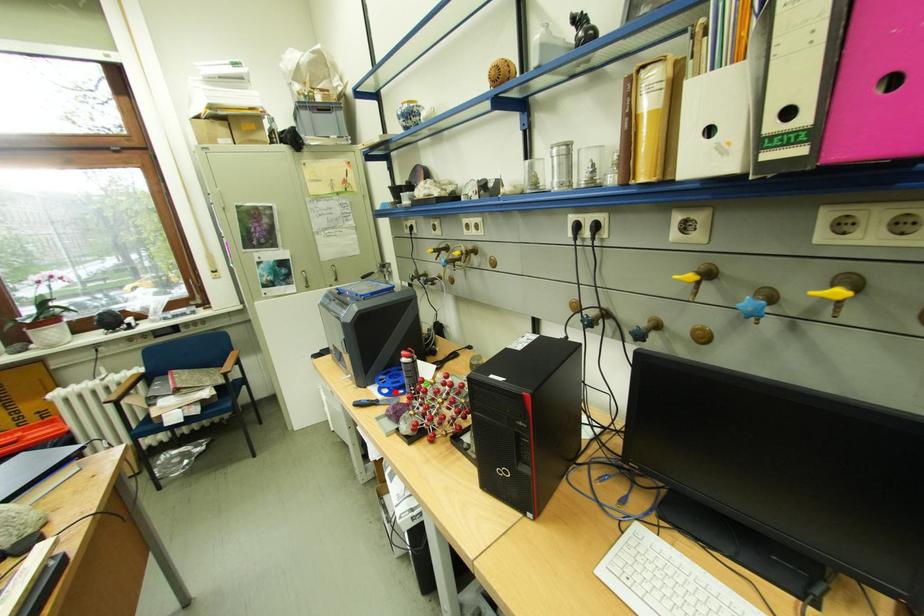
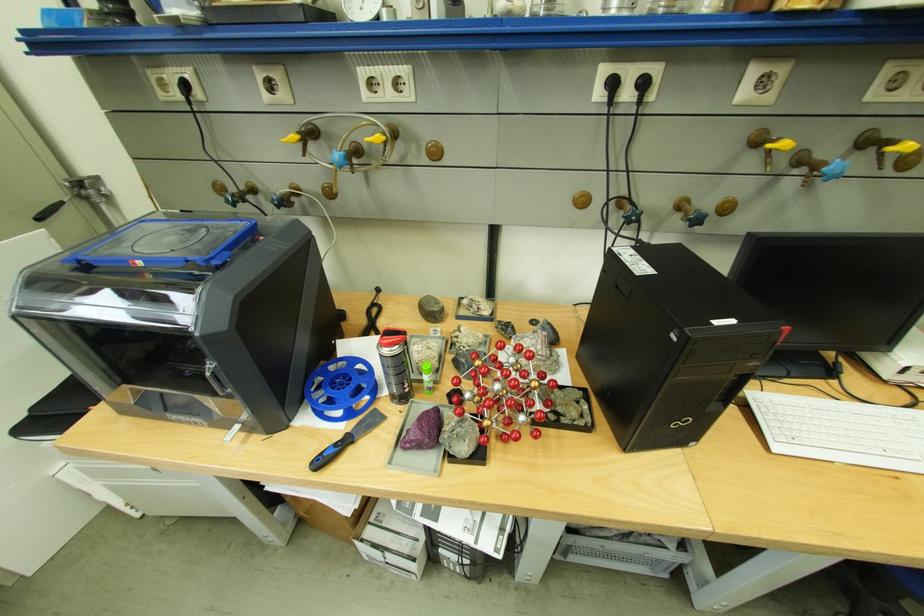
Question: I am providing you with two images of the same scene from different viewpoints. In image1, a red point is highlighted. Considering the same 3D point in image2, which of the following is correct?

Choices:
 (A) It is closer
 (B) It is farther

Answer: (A)